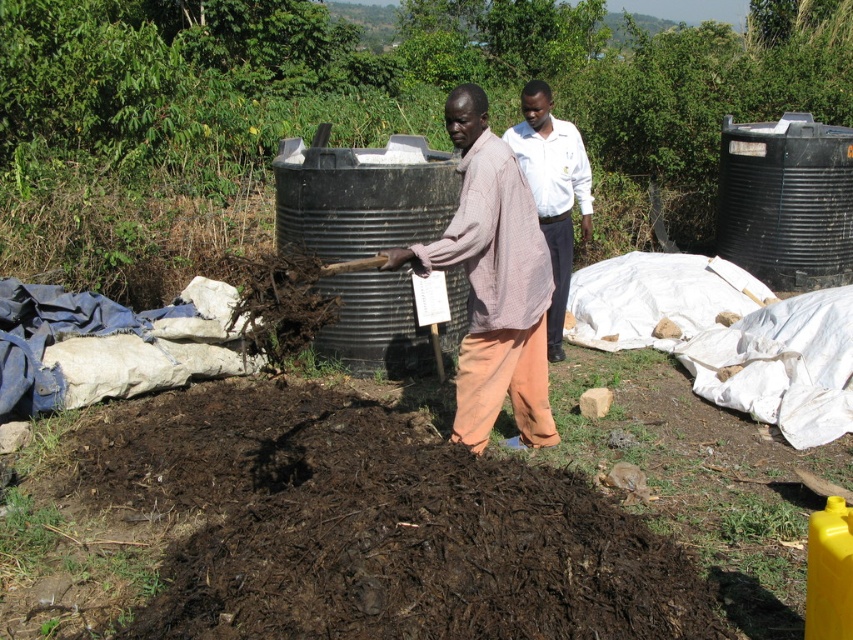
You are a gardener wearing a light brown woven shirt at center and standing near dark brown organic matter at center. You need to place a small plant in the soil. Which object should you avoid stepping on to prevent damaging it?

You should avoid stepping on the dark brown organic matter at center because it is not as tall as the light brown woven shirt at center, indicating it is the soil bed and stepping on it could compact the soil and harm the plant roots.

You are standing at the point with coordinates (492, 282) in the image. What object is located exactly at this point?

The light brown woven shirt at center is located exactly at point (492, 282).